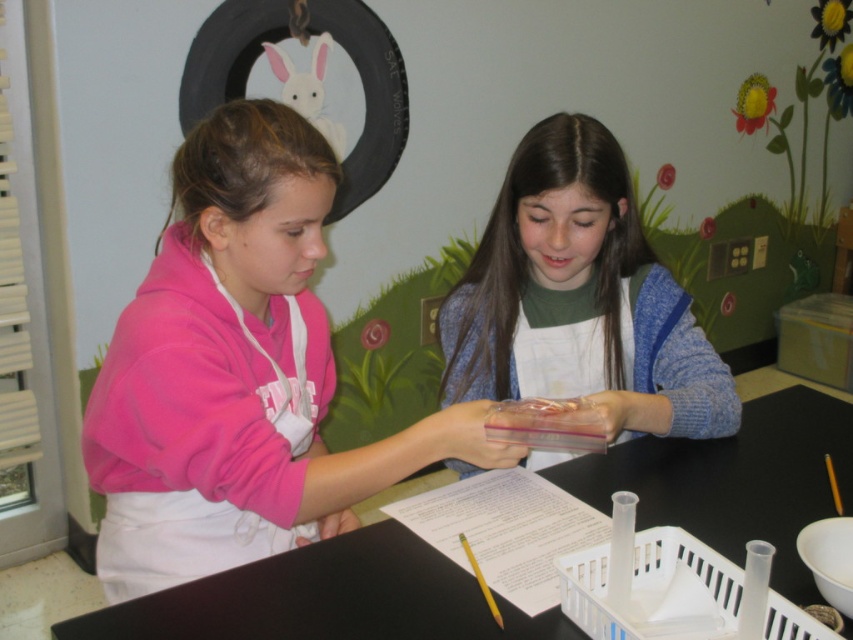
Is point (94, 628) less distant than point (569, 202)?

Yes, it is in front of point (569, 202).

Is black plastic table at center positioned before translucent plastic container at center?

Yes, it is.

Is point (786, 502) less distant than point (532, 152)?

Yes, it is.

Find the location of `black plastic table at center`. black plastic table at center is located at coordinates (326, 600).

Is pink fleece jacket at left smaller than black plastic table at center?

No, pink fleece jacket at left is not smaller than black plastic table at center.

Can you confirm if pink fleece jacket at left is positioned above black plastic table at center?

Indeed, pink fleece jacket at left is positioned over black plastic table at center.

Between point (183, 556) and point (460, 602), which one is positioned behind?

Positioned behind is point (183, 556).

Where is `pink fleece jacket at left`? The width and height of the screenshot is (853, 640). pink fleece jacket at left is located at coordinates (236, 372).

Which is above, pink fleece jacket at left or translucent plastic container at center?

translucent plastic container at center is above.

Who is more forward, [207,364] or [625,337]?

Point [207,364] is in front.

This screenshot has width=853, height=640. In order to click on pink fleece jacket at left in this screenshot , I will do `click(236, 372)`.